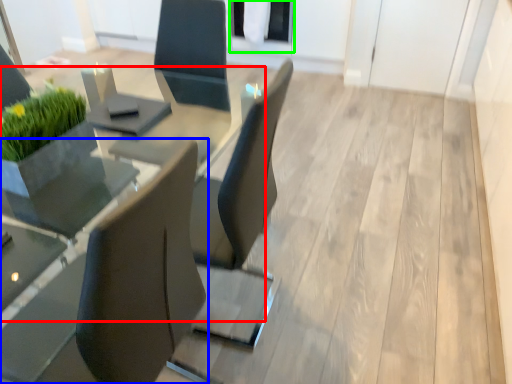
Question: Which object is positioned closest to round table (highlighted by a red box)? Select from chair (highlighted by a blue box) and glass door (highlighted by a green box).

Choices:
 (A) chair
 (B) glass door

Answer: (A)